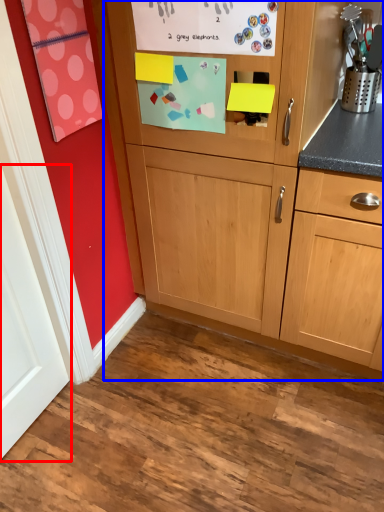
Question: Which object is further to the camera taking this photo, door (highlighted by a red box) or cabinetry (highlighted by a blue box)?

Choices:
 (A) door
 (B) cabinetry

Answer: (B)